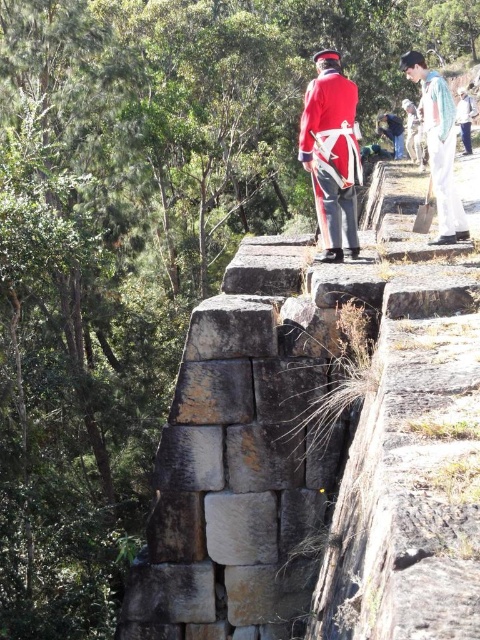
Identify the location of red fabric uniform at center. (332, 154).

The height and width of the screenshot is (640, 480). What do you see at coordinates (332, 154) in the screenshot?
I see `red fabric uniform at center` at bounding box center [332, 154].

Which is behind, point (324, 225) or point (451, 227)?

Point (451, 227)

Identify the location of red fabric uniform at center. The image size is (480, 640). (332, 154).

Does rustic stone wall at center have a lesser width compared to red woolen coat at upper right?

No.

Does rustic stone wall at center have a lesser height compared to red woolen coat at upper right?

No, rustic stone wall at center is not shorter than red woolen coat at upper right.

Which is behind, point (429, 305) or point (467, 125)?

Point (467, 125)

I want to click on rustic stone wall at center, so click(321, 452).

Does point (317, 93) lie behind point (416, 122)?

That is False.

Who is more distant from viewer, (335, 156) or (406, 128)?

The point (406, 128) is behind.

Where is `red fabric uniform at center`? The height and width of the screenshot is (640, 480). red fabric uniform at center is located at coordinates (332, 154).